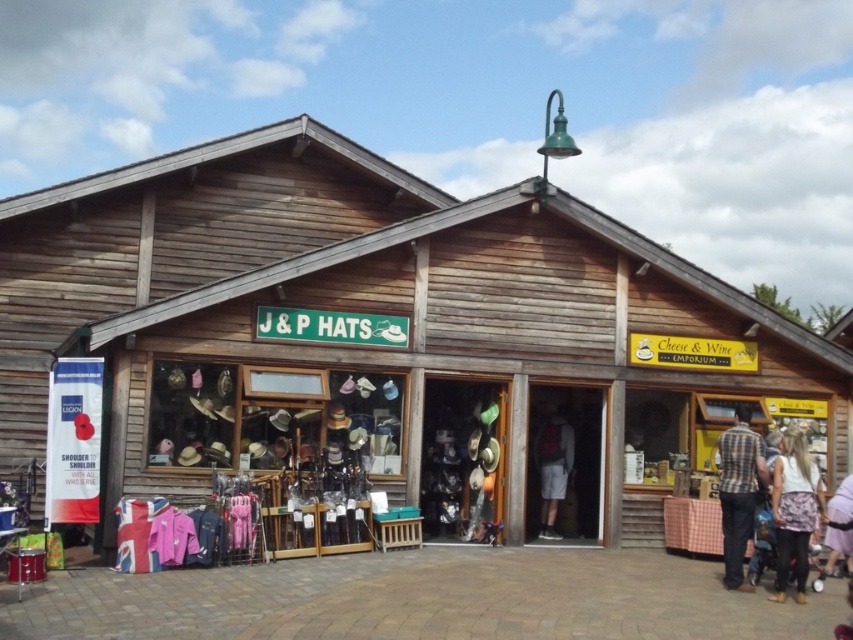
Question: Which object appears farthest from the camera in this image?

Choices:
 (A) wooden building at center
 (B) floral skirt at lower right
 (C) plaid shirt at center

Answer: (A)

Question: From the image, what is the correct spatial relationship of wooden building at center in relation to floral skirt at lower right?

Choices:
 (A) below
 (B) above

Answer: (B)

Question: Is wooden building at center thinner than plaid shirt at center?

Choices:
 (A) yes
 (B) no

Answer: (B)

Question: Which point is closer to the camera?

Choices:
 (A) (553, 449)
 (B) (416, 385)
 (C) (740, 561)

Answer: (C)

Question: Which object is the closest to the wooden building at center?

Choices:
 (A) floral skirt at lower right
 (B) dark gray fabric shorts at center
 (C) plaid shirt at center

Answer: (B)

Question: Is floral skirt at lower right to the left of plaid shirt at center from the viewer's perspective?

Choices:
 (A) no
 (B) yes

Answer: (A)